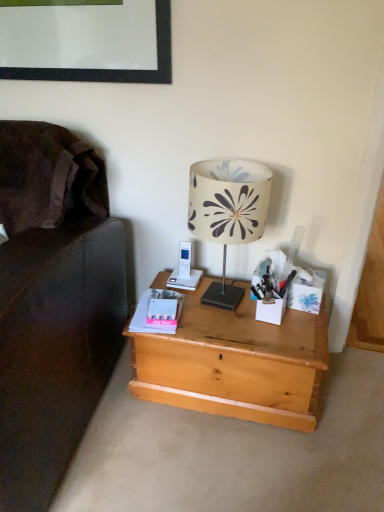
Where is `vacant area that lies between matte pink paperback book at center-left and white matte stationery at right`? vacant area that lies between matte pink paperback book at center-left and white matte stationery at right is located at coordinates (221, 319).